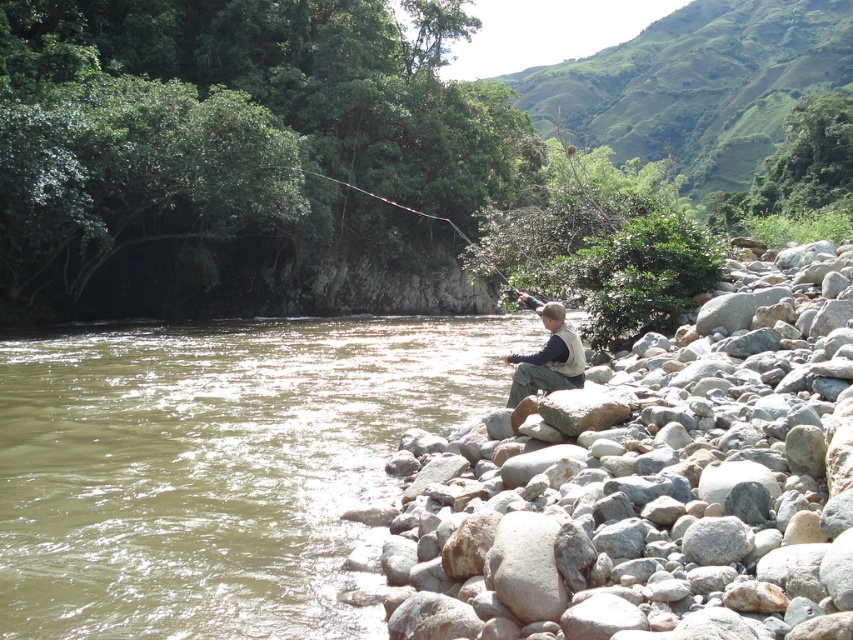
You are a photographer aiming to capture the smooth brown fishing rod at upper center without the gray smooth rock at right appearing in the frame. Based on their positions, is this possible?

The gray smooth rock at right is in front of the smooth brown fishing rod at upper center, so it would block the view. To avoid capturing the gray smooth rock at right, you would need to adjust your angle or position to ensure the smooth brown fishing rod at upper center is not obscured.

You are a photographer aiming to capture the entire scene of the greenish water at lower left and the light brown fabric vest at center in a single frame. Based on their widths, which object should you position closer to the camera to ensure both fit within the frame?

The greenish water at lower left is wider than the light brown fabric vest at center. To fit both in the frame, position the greenish water at lower left closer to the camera since its greater width requires more space in the photo.

You are a photographer trying to capture the fishing rod and the rock in the scene. Since the gray smooth rock at right is shorter than the smooth brown fishing rod at upper center, how might you position your camera to ensure both are fully visible in the frame?

To ensure both the gray smooth rock at right and the smooth brown fishing rod at upper center are fully visible, position the camera at a lower angle so that the shorter gray smooth rock at right isn not cropped out while still capturing the taller smooth brown fishing rod at upper center in its entirety.